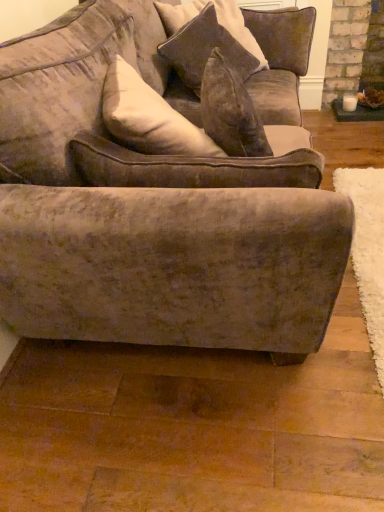
In order to face velvet brown couch at center, should I rotate leftwards or rightwards?

Turn right approximately 0.209 degrees to face it.

Locate an element on the screen. velvet brown couch at center is located at coordinates (151, 206).

Locate an element on the screen. This screenshot has width=384, height=512. velvet cushion at upper center is located at coordinates (205, 44).

Describe the element at coordinates (100, 115) in the screenshot. The image size is (384, 512). I see `velvet brown couch at center` at that location.

Find the location of a particular element. velvet brown couch at center is located at coordinates (151, 206).

Does point (188, 35) come closer to viewer compared to point (277, 117)?

Yes, it is in front of point (277, 117).

Does velvet cushion at upper center come in front of velvet brown couch at center?

No.

Is velvet cushion at upper center not within velvet brown couch at center?

Indeed, velvet cushion at upper center is completely outside velvet brown couch at center.

From the image's perspective, between velvet cushion at upper center and velvet brown couch at center, which one is located above?

velvet cushion at upper center appears higher in the image.

How far apart are velvet brown couch at center and velvet brown couch at center?

velvet brown couch at center is 5.58 inches away from velvet brown couch at center.

From the picture: From a real-world perspective, which is physically above, velvet brown couch at center or velvet brown couch at center?

From a 3D spatial view, velvet brown couch at center is above.

From the image's perspective, is velvet brown couch at center under velvet brown couch at center?

No, from the image's perspective, velvet brown couch at center is not beneath velvet brown couch at center.

Which object is further away from the camera, velvet brown couch at center or velvet brown couch at center?

velvet brown couch at center.

What's the angular difference between velvet cushion at upper center and velvet brown couch at center's facing directions?

34.3 degrees.

Is point (179, 74) farther from camera compared to point (337, 233)?

Yes.

From a real-world perspective, between velvet cushion at upper center and velvet brown couch at center, who is vertically higher?

velvet cushion at upper center.

Considering the relative sizes of velvet brown couch at center and velvet cushion at upper center in the image provided, is velvet brown couch at center thinner than velvet cushion at upper center?

In fact, velvet brown couch at center might be wider than velvet cushion at upper center.

Locate an element on the screen. The width and height of the screenshot is (384, 512). pillow above the velvet brown couch at center (from a real-world perspective) is located at coordinates (205, 44).

Is velvet brown couch at center taller or shorter than velvet cushion at upper center?

velvet brown couch at center is taller than velvet cushion at upper center.

From the picture: Is velvet brown couch at center to the left or to the right of velvet cushion at upper center in the image?

In the image, velvet brown couch at center appears on the left side of velvet cushion at upper center.

Is velvet brown couch at center inside the boundaries of velvet cushion at upper center, or outside?

velvet brown couch at center exists outside the volume of velvet cushion at upper center.

Which object is positioned more to the left, velvet brown couch at center or velvet cushion at upper center?

velvet brown couch at center is more to the left.

From their relative heights in the image, would you say velvet brown couch at center is taller or shorter than velvet cushion at upper center?

Clearly, velvet brown couch at center is taller compared to velvet cushion at upper center.

From a real-world perspective, between velvet brown couch at center and velvet cushion at upper center, who is vertically higher?

velvet brown couch at center is physically above.

From a real-world perspective, is velvet brown couch at center above or below velvet brown couch at center?

Clearly, from a real-world perspective, velvet brown couch at center is above velvet brown couch at center.

Is velvet brown couch at center surrounded by velvet brown couch at center?

No, velvet brown couch at center does not contain velvet brown couch at center.

Looking at this image, does velvet brown couch at center turn towards velvet brown couch at center?

Yes, velvet brown couch at center is aimed at velvet brown couch at center.

Is point (278, 106) positioned behind point (117, 234)?

That is True.

The height and width of the screenshot is (512, 384). What are the coordinates of `couch on the left of velvet cushion at upper center` in the screenshot? It's located at (100, 115).

Locate an element on the screen. couch that is below the velvet brown couch at center (from the image's perspective) is located at coordinates (100, 115).

From the image, which object appears to be farther from velvet cushion at upper center, velvet brown couch at center or velvet brown couch at center?

velvet brown couch at center.

Which object lies further to the anchor point velvet brown couch at center, velvet cushion at upper center or velvet brown couch at center?

velvet cushion at upper center lies further to velvet brown couch at center than the other object.

Looking at the image, which one is located closer to velvet cushion at upper center, velvet brown couch at center or velvet brown couch at center?

Based on the image, velvet brown couch at center appears to be nearer to velvet cushion at upper center.

From the image, which object appears to be farther from velvet brown couch at center, velvet brown couch at center or velvet cushion at upper center?

velvet cushion at upper center is positioned further to the anchor velvet brown couch at center.

Based on their spatial positions, is velvet brown couch at center or velvet cushion at upper center further from velvet brown couch at center?

velvet cushion at upper center lies further to velvet brown couch at center than the other object.

Considering their positions, is velvet cushion at upper center positioned further to velvet brown couch at center than velvet brown couch at center?

velvet cushion at upper center.

The width and height of the screenshot is (384, 512). What are the coordinates of `couch between velvet brown couch at center and velvet cushion at upper center from front to back` in the screenshot? It's located at (100, 115).